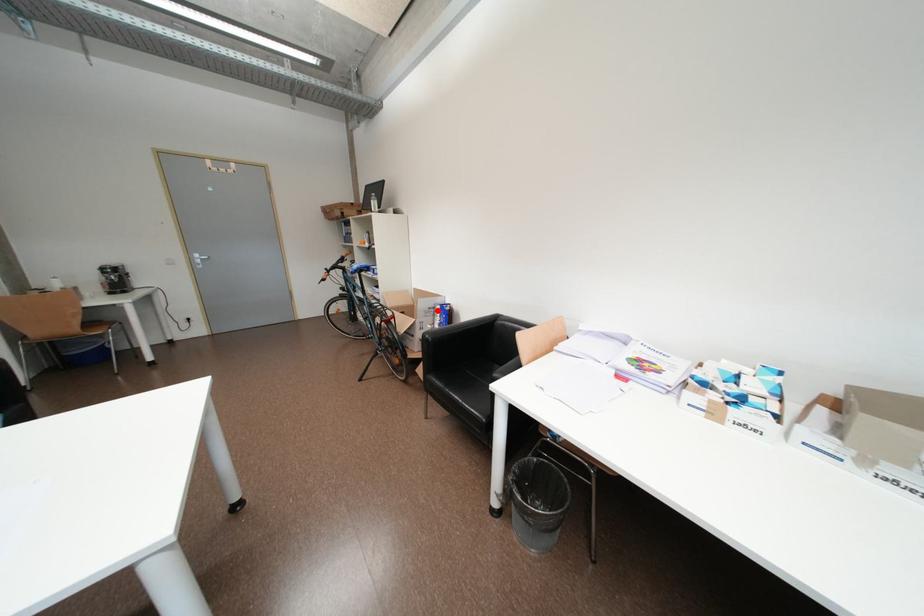
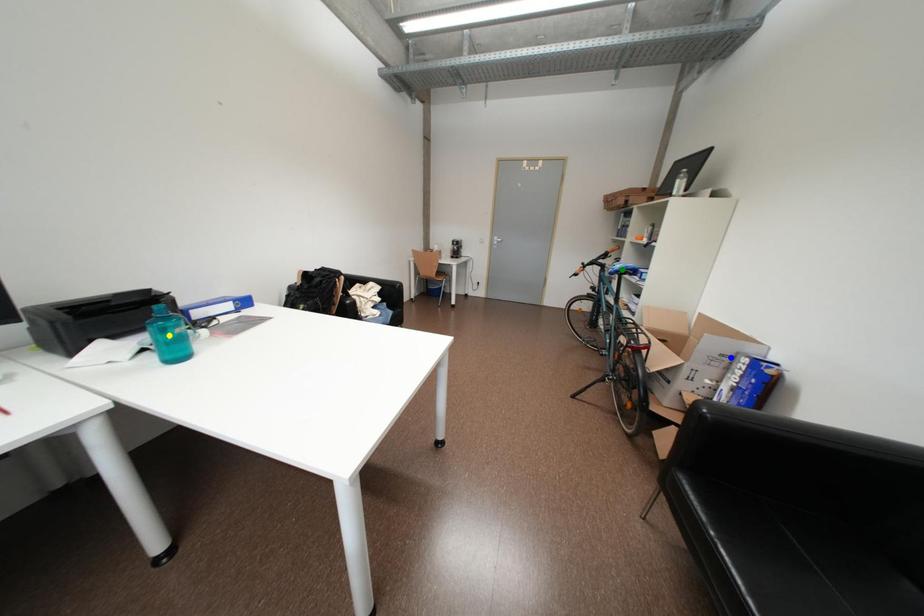
Question: I am providing you with two images of the same scene from different viewpoints. A red point is marked on the first image. You are given multiple points on the second image. In image 2, which mark is for the same physical point as the one in image 1?

Choices:
 (A) green point
 (B) yellow point
 (C) blue point

Answer: (C)